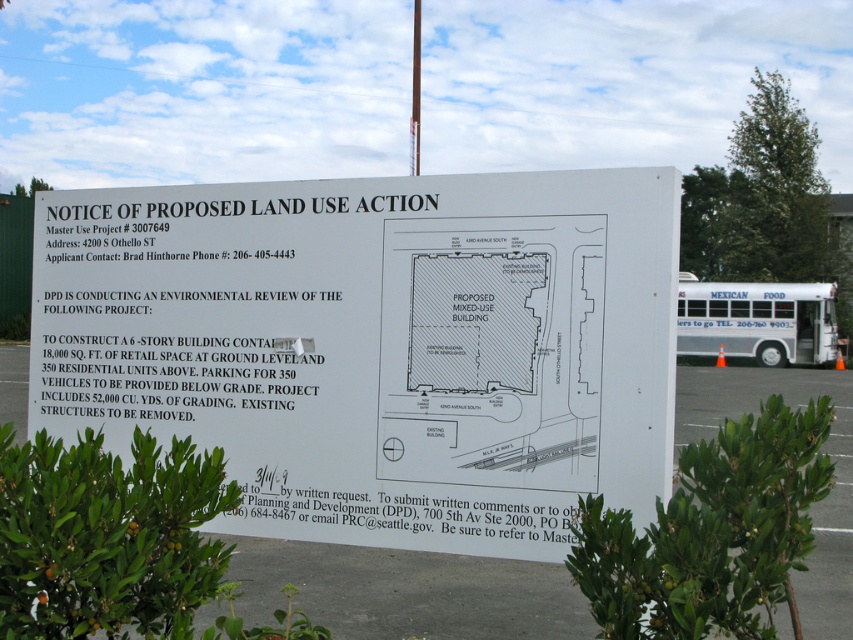
Question: Which object is farther from the camera taking this photo?

Choices:
 (A) white paper sign at center
 (B) white concrete parking lot at center
 (C) white metallic bus at center

Answer: (B)

Question: Which object appears closest to the camera in this image?

Choices:
 (A) white paper sign at center
 (B) white metallic bus at center
 (C) white concrete parking lot at center

Answer: (B)

Question: Which of the following is the closest to the observer?

Choices:
 (A) (331, 506)
 (B) (22, 422)

Answer: (A)

Question: Does white concrete parking lot at center have a lesser width compared to white metallic bus at center?

Choices:
 (A) yes
 (B) no

Answer: (B)

Question: Can you confirm if white paper sign at center is bigger than white metallic bus at center?

Choices:
 (A) no
 (B) yes

Answer: (A)

Question: Is white paper sign at center bigger than white concrete parking lot at center?

Choices:
 (A) yes
 (B) no

Answer: (B)